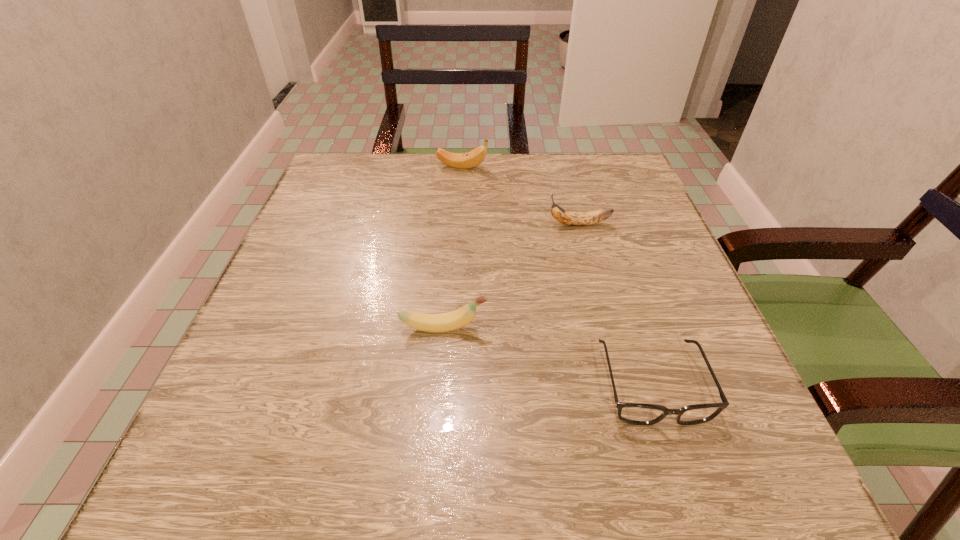
Where is `vacant space situated 0.310m at the stem of the nearest banana`? The image size is (960, 540). vacant space situated 0.310m at the stem of the nearest banana is located at coordinates (670, 328).

In order to click on free location located on the front-facing side of the nearest object in this screenshot , I will do [685, 488].

At what (x,y) coordinates should I click in order to perform the action: click on object that is at the far edge. Please return your answer as a coordinate pair (x, y). The height and width of the screenshot is (540, 960). Looking at the image, I should click on (473, 158).

Where is `banana that is positioned at the right edge`? banana that is positioned at the right edge is located at coordinates (563, 216).

Locate an element on the screen. This screenshot has width=960, height=540. spectacles at the right edge is located at coordinates (632, 413).

Where is `vacant space at the far edge of the desktop`? This screenshot has width=960, height=540. vacant space at the far edge of the desktop is located at coordinates (519, 166).

In the image, there is a desktop. In order to click on vacant area at the near edge in this screenshot , I will do `click(372, 455)`.

You are a GUI agent. You are given a task and a screenshot of the screen. Output one action in this format:
    pyautogui.click(x=<x>, y=<y>)
    Task: Click on the vacant region at the left edge of the desktop
    
    Given the screenshot: What is the action you would take?
    pyautogui.click(x=339, y=232)

In the image, there is a desktop. In order to click on vacant space at the right edge in this screenshot , I will do `click(627, 346)`.

In the image, there is a desktop. In order to click on blank space at the far left corner in this screenshot , I will do `click(319, 197)`.